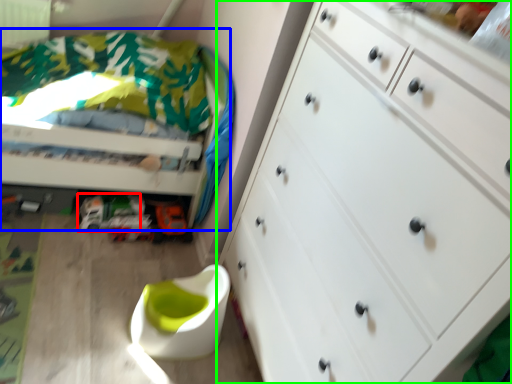
Question: Based on their relative distances, which object is nearer to toy car (highlighted by a red box)? Choose from bed (highlighted by a blue box) and chest of drawers (highlighted by a green box).

Choices:
 (A) bed
 (B) chest of drawers

Answer: (A)